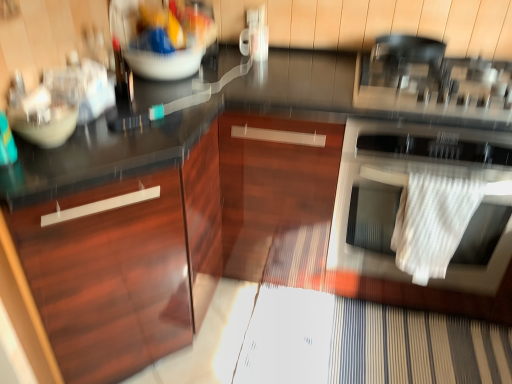
Question: From the image's perspective, does glossy wood cabinet at left appear higher than white textured towel at right?

Choices:
 (A) yes
 (B) no

Answer: (B)

Question: Is the position of glossy wood cabinet at left more distant than that of white textured towel at right?

Choices:
 (A) no
 (B) yes

Answer: (A)

Question: Considering the relative sizes of glossy wood cabinet at left and white textured towel at right in the image provided, is glossy wood cabinet at left taller than white textured towel at right?

Choices:
 (A) no
 (B) yes

Answer: (B)

Question: From a real-world perspective, does glossy wood cabinet at left stand above white textured towel at right?

Choices:
 (A) no
 (B) yes

Answer: (A)

Question: Is glossy wood cabinet at left positioned in front of white textured towel at right?

Choices:
 (A) no
 (B) yes

Answer: (B)

Question: From a real-world perspective, relative to matte white bowl at left, is glossy wood cabinet at left vertically above or below?

Choices:
 (A) above
 (B) below

Answer: (B)

Question: Do you think glossy wood cabinet at left is within matte white bowl at left, or outside of it?

Choices:
 (A) inside
 (B) outside

Answer: (B)

Question: In the image, is glossy wood cabinet at left on the left side or the right side of matte white bowl at left?

Choices:
 (A) left
 (B) right

Answer: (B)

Question: From their relative heights in the image, would you say glossy wood cabinet at left is taller or shorter than matte white bowl at left?

Choices:
 (A) short
 (B) tall

Answer: (B)

Question: From the image's perspective, is matte white bowl at left located above or below white textured towel at right?

Choices:
 (A) above
 (B) below

Answer: (A)

Question: Considering the positions of point (30, 125) and point (351, 269), is point (30, 125) closer or farther from the camera than point (351, 269)?

Choices:
 (A) closer
 (B) farther

Answer: (A)

Question: Is matte white bowl at left inside or outside of white textured towel at right?

Choices:
 (A) inside
 (B) outside

Answer: (B)

Question: Considering the relative positions of matte white bowl at left and white textured towel at right in the image provided, is matte white bowl at left to the left or to the right of white textured towel at right?

Choices:
 (A) left
 (B) right

Answer: (A)

Question: In terms of width, does white textured towel at right look wider or thinner when compared to white textured towel at right?

Choices:
 (A) wide
 (B) thin

Answer: (B)

Question: Would you say white textured towel at right is to the left or to the right of white textured towel at right in the picture?

Choices:
 (A) left
 (B) right

Answer: (A)